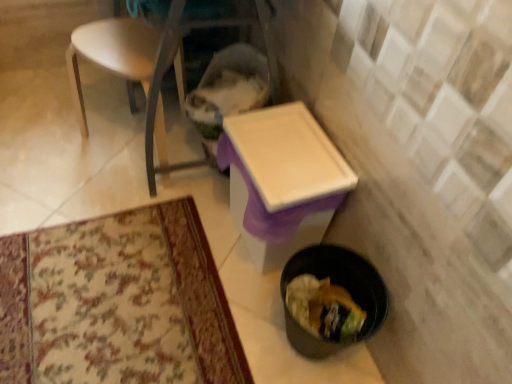
I want to click on free space above white plastic chair at upper left (from a real-world perspective), so click(x=117, y=47).